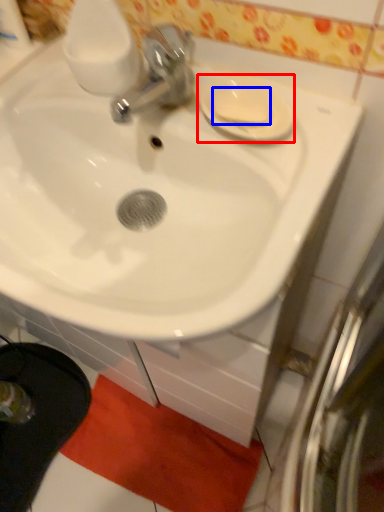
Question: Which of the following is the closest to the observer, saucer (highlighted by a red box) or soap (highlighted by a blue box)?

Choices:
 (A) saucer
 (B) soap

Answer: (A)